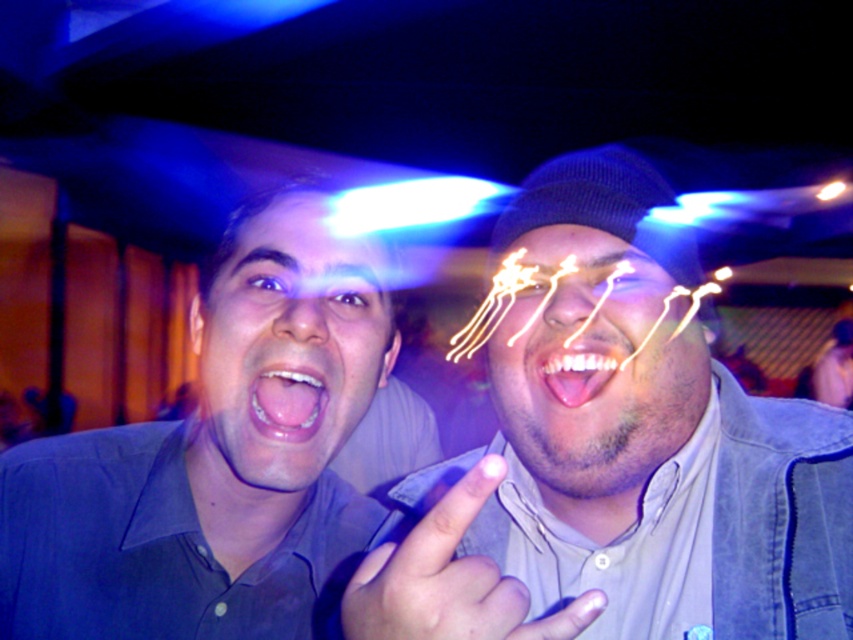
You are standing in the dimly lit indoor space and see two points in the image. Which point is closer to you, point (x=311, y=262) or point (x=532, y=237)?

Point (x=532, y=237) is closer to you because point (x=311, y=262) is behind it.

You are a photographer trying to capture a clear shot of both the denim jacket at right and the shiny metallic face at center in this dimly lit environment. Considering the size difference between them, which object should you focus on first to ensure proper exposure?

The denim jacket at right has a larger size compared to shiny metallic face at center, so you should focus on the denim jacket at right first to ensure proper exposure.

You are a photographer trying to capture a clear portrait of the matte gray shirt at center. Given that your camera focuses best within 20 inches, will you need to adjust your position?

The matte gray shirt at center is 22.58 inches away from the camera, which is beyond the optimal focus range of 20 inches. To capture a clear portrait, you should move closer to reduce the distance to within 20 inches.